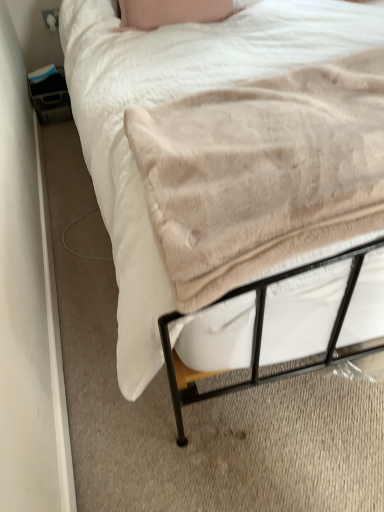
This screenshot has width=384, height=512. Describe the element at coordinates (262, 172) in the screenshot. I see `beige plush blanket at center` at that location.

This screenshot has height=512, width=384. I want to click on beige plush blanket at center, so click(262, 172).

What is the approximate width of beige soft blanket at lower left?

The width of beige soft blanket at lower left is 32.66 inches.

Describe the element at coordinates (161, 99) in the screenshot. I see `beige soft blanket at lower left` at that location.

Find the location of `beige soft blanket at lower left`. beige soft blanket at lower left is located at coordinates (161, 99).

This screenshot has width=384, height=512. I want to click on beige plush blanket at center, so click(262, 172).

Is beige soft blanket at lower left to the left or to the right of beige plush blanket at center in the image?

Based on their positions, beige soft blanket at lower left is located to the left of beige plush blanket at center.

Is the position of beige soft blanket at lower left more distant than that of beige plush blanket at center?

Yes.

Which is in front, point (121, 292) or point (216, 97)?

Point (121, 292)

From the picture: From the image's perspective, is beige soft blanket at lower left on beige plush blanket at center?

Yes, from the image's perspective, beige soft blanket at lower left is over beige plush blanket at center.

In the scene shown: From a real-world perspective, who is located lower, beige soft blanket at lower left or beige plush blanket at center?

beige soft blanket at lower left.

Which object is wider, beige soft blanket at lower left or beige plush blanket at center?

With larger width is beige soft blanket at lower left.

Can you confirm if beige soft blanket at lower left is shorter than beige plush blanket at center?

Indeed, beige soft blanket at lower left has a lesser height compared to beige plush blanket at center.

Looking at this image, which of these two, beige soft blanket at lower left or beige plush blanket at center, is smaller?

beige plush blanket at center is smaller.

Is beige soft blanket at lower left spatially inside beige plush blanket at center, or outside of it?

beige soft blanket at lower left cannot be found inside beige plush blanket at center.

Is beige soft blanket at lower left not close to beige plush blanket at center?

beige soft blanket at lower left is actually quite close to beige plush blanket at center.

Is beige soft blanket at lower left facing away from beige plush blanket at center?

No.

Can you tell me how much beige soft blanket at lower left and beige plush blanket at center differ in facing direction?

The angle between the facing direction of beige soft blanket at lower left and the facing direction of beige plush blanket at center is 90.6 degrees.

What are the coordinates of `bed on the left of beige plush blanket at center` in the screenshot? It's located at (161, 99).

Which object is positioned more to the right, beige plush blanket at center or beige soft blanket at lower left?

beige plush blanket at center is more to the right.

Relative to beige soft blanket at lower left, is beige plush blanket at center in front or behind?

beige plush blanket at center is in front of beige soft blanket at lower left.

Is point (176, 194) positioned behind point (139, 198)?

No.

From the image's perspective, between beige plush blanket at center and beige soft blanket at lower left, which one is located above?

beige soft blanket at lower left appears higher in the image.

From a real-world perspective, is beige plush blanket at center positioned above or below beige soft blanket at lower left?

Clearly, from a real-world perspective, beige plush blanket at center is above beige soft blanket at lower left.

Is beige plush blanket at center wider or thinner than beige soft blanket at lower left?

beige plush blanket at center is thinner than beige soft blanket at lower left.

Considering the sizes of objects beige plush blanket at center and beige soft blanket at lower left in the image provided, who is taller, beige plush blanket at center or beige soft blanket at lower left?

With more height is beige plush blanket at center.

Is beige plush blanket at center bigger than beige soft blanket at lower left?

No.

Does beige plush blanket at center contain beige soft blanket at lower left?

No, beige soft blanket at lower left is not inside beige plush blanket at center.

Is beige plush blanket at center far away from beige soft blanket at lower left?

No, there isn't a large distance between beige plush blanket at center and beige soft blanket at lower left.

Is beige plush blanket at center positioned with its back to beige soft blanket at lower left?

No, beige plush blanket at center is not facing away from beige soft blanket at lower left.

What's the angular difference between beige plush blanket at center and beige soft blanket at lower left's facing directions?

90.6 degrees.

How much distance is there between beige plush blanket at center and beige soft blanket at lower left?

They are 9.94 inches apart.

You are a GUI agent. You are given a task and a screenshot of the screen. Output one action in this format:
    pyautogui.click(x=<x>, y=<y>)
    Task: Click on the blanket above the beige soft blanket at lower left (from a real-world perspective)
    The width and height of the screenshot is (384, 512).
    Given the screenshot: What is the action you would take?
    pyautogui.click(x=262, y=172)

This screenshot has width=384, height=512. Find the location of `blanket located below the beige soft blanket at lower left (from the image's perspective)`. blanket located below the beige soft blanket at lower left (from the image's perspective) is located at coordinates tap(262, 172).

This screenshot has height=512, width=384. In order to click on blanket that appears on the right of beige soft blanket at lower left in this screenshot , I will do `click(262, 172)`.